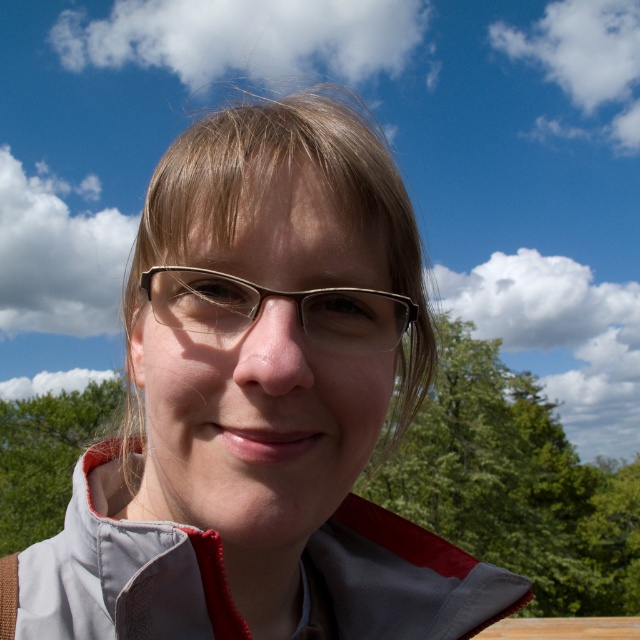
You are standing 20 inches away from the matte gray jacket at center. Can you reach it without moving your feet?

The matte gray jacket at center is 15.59 inches from viewer, so yes, you can reach it without moving your feet since you are standing 20 inches away which is farther than the jacket distance.

You are a photographer adjusting your camera settings to focus on the metallic gold glasses at center in the scene. Based on their position, which part of the image should you adjust the focus to ensure clarity?

The metallic gold glasses at center are located at point coordinates approximately 0.464 on the x and 0.439 on the y axis. To focus clearly, adjust the camera to the coordinates corresponding to these values.

You are an artist preparing to sketch the scene. You need to decide which object to draw first based on their size. Which object should you start with, the metallic gold glasses at center or the green leafy tree at lower left?

The metallic gold glasses at center has a lesser width compared to the green leafy tree at lower left, so you should start with the smaller metallic gold glasses at center to ensure proper scaling when adding the larger green leafy tree at lower left later.